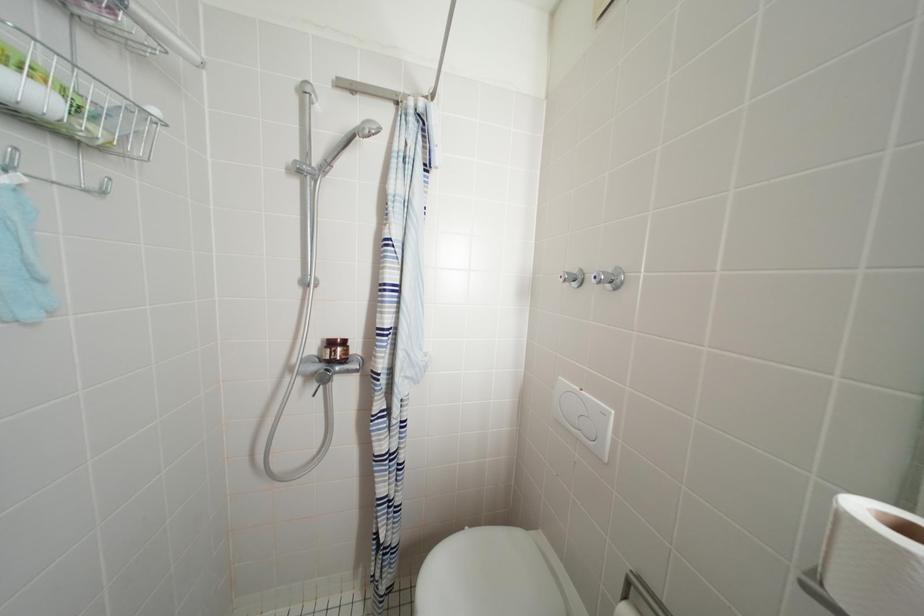
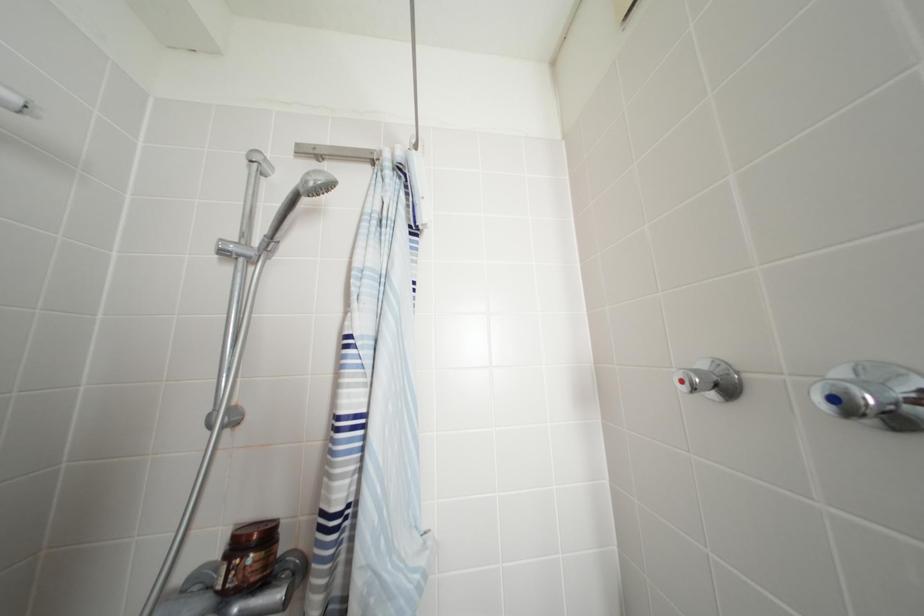
Question: How did the camera likely rotate?

Choices:
 (A) Left
 (B) Right
 (C) Up
 (D) Down

Answer: (C)